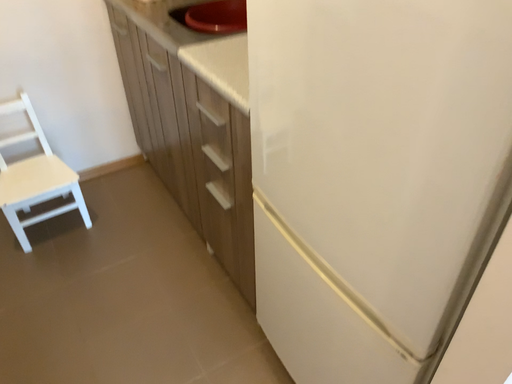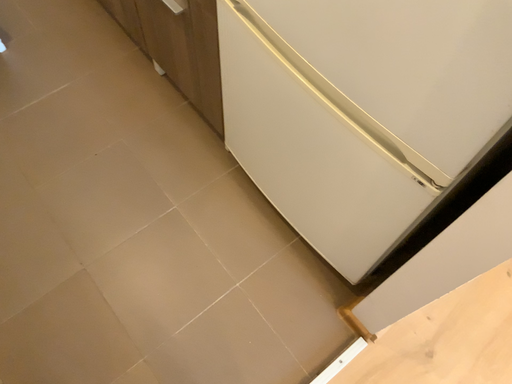
Question: Which way did the camera rotate in the video?

Choices:
 (A) rotated upward
 (B) rotated downward

Answer: (B)